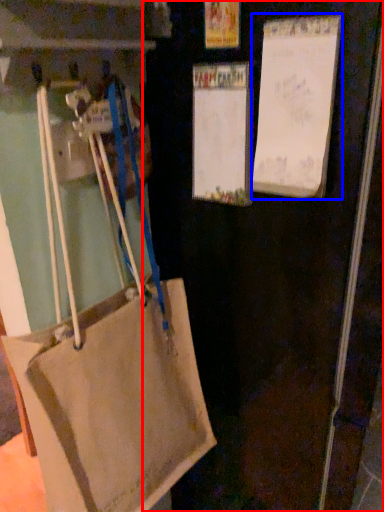
Question: Which point is closer to the camera, door (highlighted by a red box) or bulletin board (highlighted by a blue box)?

Choices:
 (A) door
 (B) bulletin board

Answer: (A)